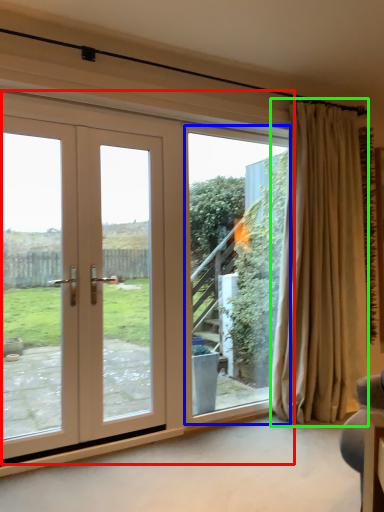
Question: Estimate the real-world distances between objects in this image. Which object is closer to door (highlighted by a red box), window screen (highlighted by a blue box) or curtain (highlighted by a green box)?

Choices:
 (A) window screen
 (B) curtain

Answer: (A)